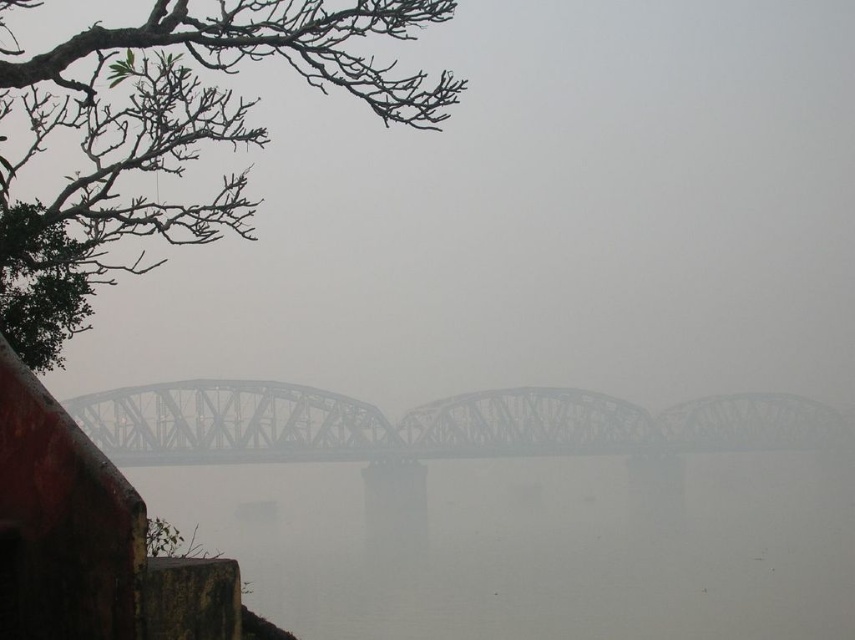
Question: Which point is closer to the camera taking this photo?

Choices:
 (A) (721, 160)
 (B) (720, 582)

Answer: (B)

Question: Which is nearer to the steel bridge at center?

Choices:
 (A) foggy gray bridge at center
 (B) gray foggy river at center

Answer: (B)

Question: Is foggy gray bridge at center above gray foggy river at center?

Choices:
 (A) yes
 (B) no

Answer: (A)

Question: Which object is positioned farthest from the foggy gray bridge at center?

Choices:
 (A) steel bridge at center
 (B) gray foggy river at center

Answer: (B)

Question: Does foggy gray bridge at center appear under gray foggy river at center?

Choices:
 (A) no
 (B) yes

Answer: (A)

Question: Is gray foggy river at center wider than steel bridge at center?

Choices:
 (A) no
 (B) yes

Answer: (A)